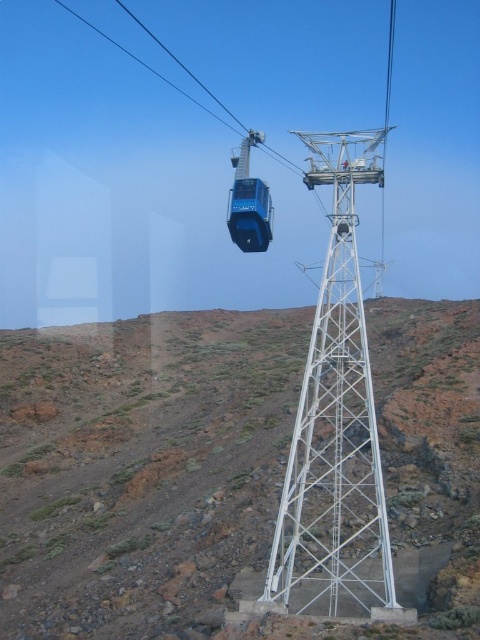
Is blue glossy cable car at center bigger than blue metallic cable car at upper center?

No, blue glossy cable car at center is not bigger than blue metallic cable car at upper center.

Between point (255, 180) and point (96, 28), which one is positioned in front?

Point (255, 180) is in front.

Locate an element on the screen. blue glossy cable car at center is located at coordinates (249, 202).

Between point (393, 13) and point (179, 92), which one is positioned in front?

Positioned in front is point (179, 92).

Who is more forward, (x=388, y=42) or (x=289, y=161)?

Point (x=289, y=161) is more forward.

Where is `metallic cable car at upper center`? metallic cable car at upper center is located at coordinates (384, 147).

Does point (286, 458) come farther from viewer compared to point (384, 136)?

Yes, it is behind point (384, 136).

Is point (156, 464) closer to viewer compared to point (389, 4)?

Yes, point (156, 464) is closer to viewer.

The width and height of the screenshot is (480, 640). Describe the element at coordinates (141, 468) in the screenshot. I see `brown rocky terrain at center` at that location.

The width and height of the screenshot is (480, 640). In order to click on brown rocky terrain at center in this screenshot , I will do `click(141, 468)`.